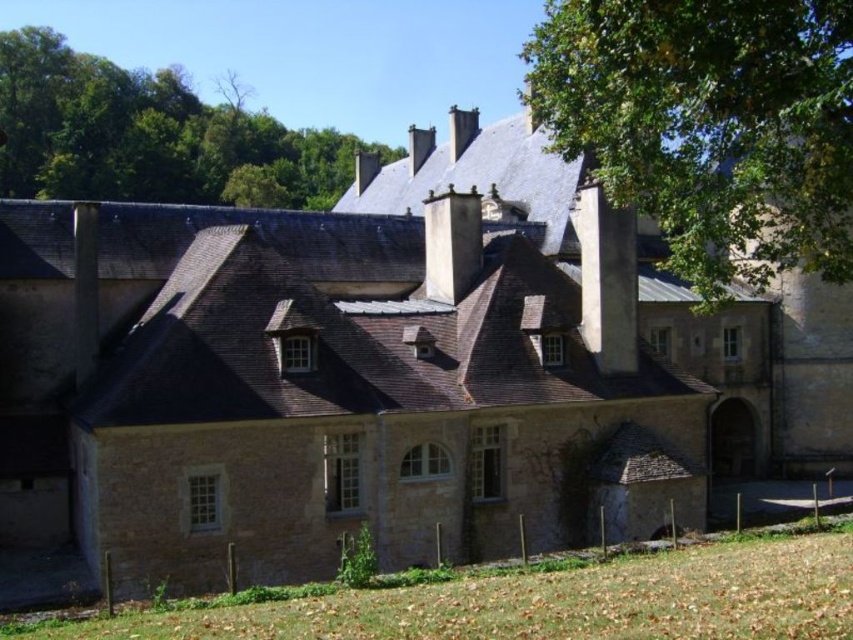
Is white stone chimney at upper center thinner than white stone chimney at center?

Yes, white stone chimney at upper center is thinner than white stone chimney at center.

The height and width of the screenshot is (640, 853). What do you see at coordinates (606, 278) in the screenshot?
I see `white stone chimney at upper center` at bounding box center [606, 278].

Identify the location of white stone chimney at upper center. Image resolution: width=853 pixels, height=640 pixels. (606, 278).

Which is behind, point (315, 182) or point (633, 294)?

The point (315, 182) is behind.

Who is higher up, green leafy tree at upper left or white stone chimney at upper center?

green leafy tree at upper left is above.

Is point (163, 74) closer to viewer compared to point (624, 234)?

No, (163, 74) is further to viewer.

Where is `green leafy tree at upper left`? Image resolution: width=853 pixels, height=640 pixels. green leafy tree at upper left is located at coordinates (149, 134).

Can you confirm if green leafy tree at upper right is wider than white stone chimney at center?

Yes.

In the scene shown: Who is more forward, (846, 236) or (433, 278)?

Point (846, 236) is more forward.

Where is `green leafy tree at upper right`? This screenshot has width=853, height=640. green leafy tree at upper right is located at coordinates (709, 125).